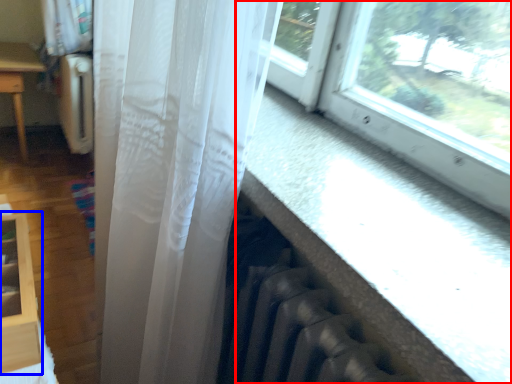
Question: Among these objects, which one is nearest to the camera, window (highlighted by a red box) or shelf (highlighted by a blue box)?

Choices:
 (A) window
 (B) shelf

Answer: (A)